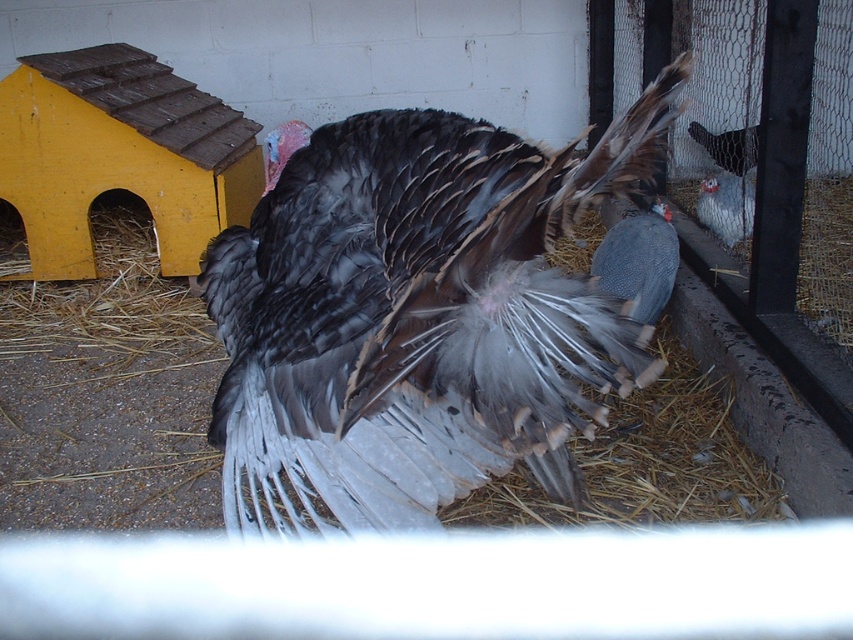
Question: Does gray feathered turkey at center have a smaller size compared to gray speckled feathered bird at right?

Choices:
 (A) yes
 (B) no

Answer: (B)

Question: Does gray feathered turkey at center come behind gray matte turkey at center?

Choices:
 (A) no
 (B) yes

Answer: (A)

Question: Which of the following is the closest to the observer?

Choices:
 (A) gray matte turkey at center
 (B) gray feathered turkey at center
 (C) gray speckled feathered bird at right

Answer: (B)

Question: Where is gray feathered turkey at center located in relation to gray matte turkey at center in the image?

Choices:
 (A) above
 (B) below

Answer: (B)

Question: Which of these objects is positioned closest to the gray speckled feathered bird at right?

Choices:
 (A) gray feathered turkey at center
 (B) gray matte turkey at center

Answer: (B)

Question: Which of the following is the farthest from the observer?

Choices:
 (A) gray matte turkey at center
 (B) gray speckled feathered bird at right

Answer: (A)